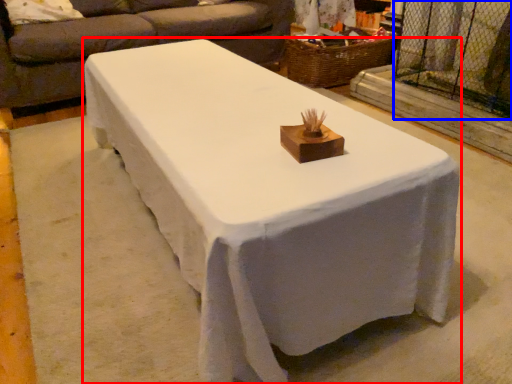
Question: Among these objects, which one is nearest to the camera, table (highlighted by a red box) or screen door (highlighted by a blue box)?

Choices:
 (A) table
 (B) screen door

Answer: (A)